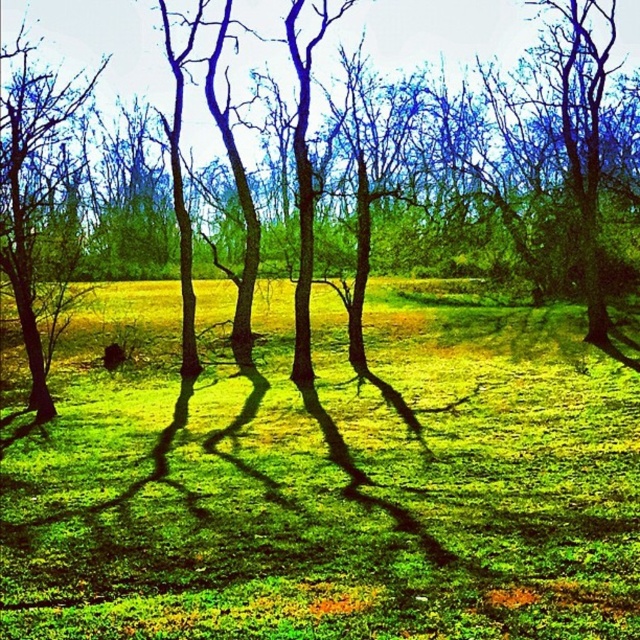
You are standing at the point marked as point (326, 481) in the image. Based on the scene description, what type of terrain are you currently standing on?

The point (326, 481) is on green grass at center, so you are standing on green grass.

You are a hiker who wants to take a photo of the green matte tree at center from a specific spot. The camera you are using has a coordinate system where the bottom left corner is the origin point. What are the exact coordinates where you should position yourself to capture the tree perfectly in the center of your photo?

The green matte tree at center is located at coordinates point (x=429, y=29), so you should position yourself directly in front of that point to capture it perfectly centered in your photo.